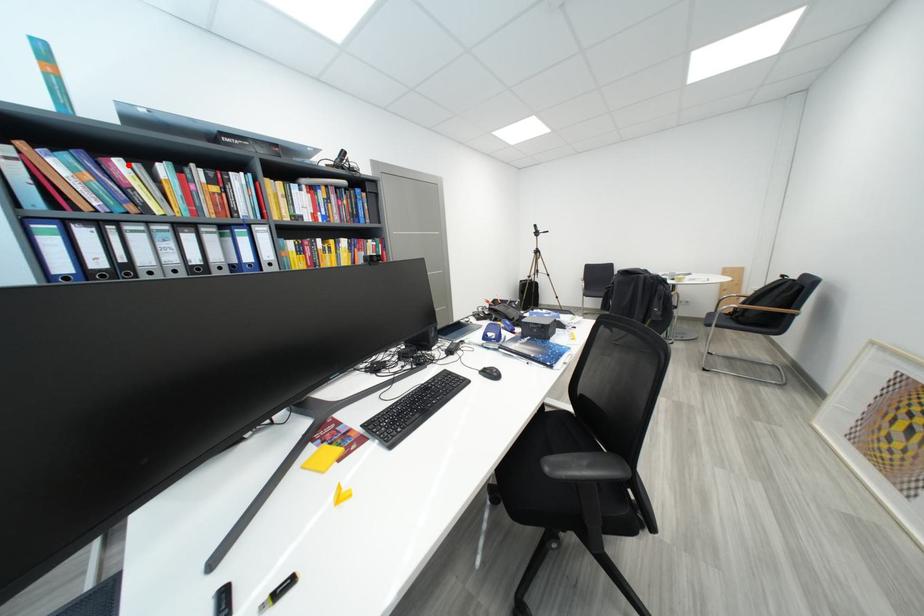
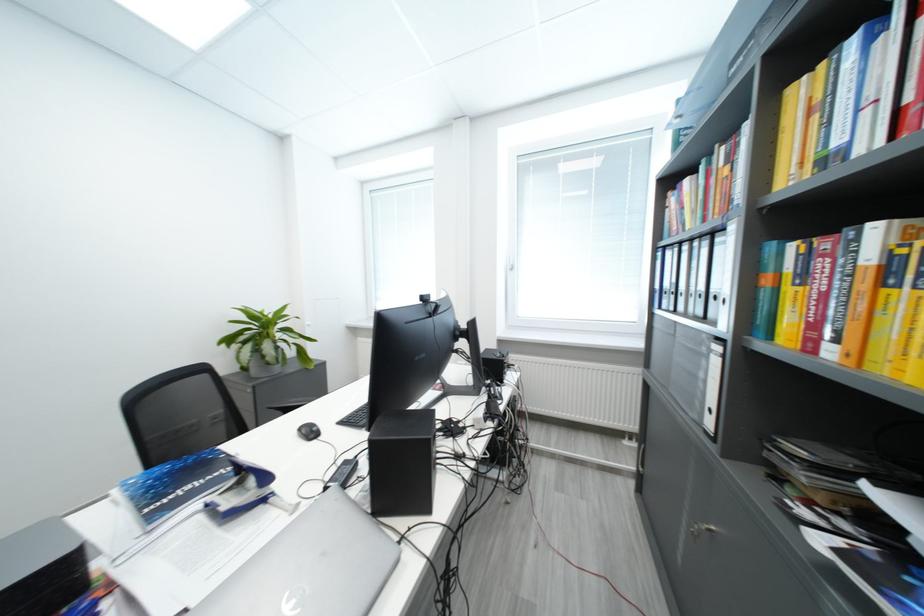
The point at the highlighted location is marked in the first image. Where is the corresponding point in the second image?

(696, 184)